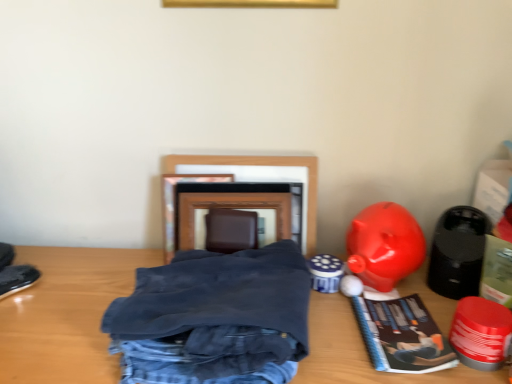
Question: From the image's perspective, is shiny plastic piggy bank at right, arranged as the first toy when viewed from the left, under black matte speaker at right, the 1th toy viewed from the right?

Choices:
 (A) yes
 (B) no

Answer: (B)

Question: From a real-world perspective, does shiny plastic piggy bank at right, which is counted as the third toy, starting from the right, stand above black matte speaker at right, the 1th toy viewed from the right?

Choices:
 (A) yes
 (B) no

Answer: (A)

Question: Does shiny plastic piggy bank at right, which is counted as the third toy, starting from the right, appear on the left side of black matte speaker at right, acting as the third toy starting from the left?

Choices:
 (A) yes
 (B) no

Answer: (A)

Question: Are shiny plastic piggy bank at right, arranged as the first toy when viewed from the left, and black matte speaker at right, acting as the third toy starting from the left, far apart?

Choices:
 (A) yes
 (B) no

Answer: (B)

Question: Considering the relative sizes of shiny plastic piggy bank at right, which is counted as the third toy, starting from the right, and black matte speaker at right, the 1th toy viewed from the right, in the image provided, is shiny plastic piggy bank at right, which is counted as the third toy, starting from the right, thinner than black matte speaker at right, the 1th toy viewed from the right,?

Choices:
 (A) yes
 (B) no

Answer: (B)

Question: Is shiny plastic piggy bank at right, arranged as the first toy when viewed from the left, beside black matte speaker at right, acting as the third toy starting from the left?

Choices:
 (A) yes
 (B) no

Answer: (B)

Question: From the image's perspective, is wooden picture frame at center on shiny plastic piggy bank at right, which is counted as the third toy, starting from the right?

Choices:
 (A) no
 (B) yes

Answer: (B)

Question: Is wooden picture frame at center turned away from shiny plastic piggy bank at right, which is counted as the third toy, starting from the right?

Choices:
 (A) no
 (B) yes

Answer: (A)

Question: Would you say shiny plastic piggy bank at right, arranged as the first toy when viewed from the left, is part of wooden picture frame at center's contents?

Choices:
 (A) no
 (B) yes

Answer: (A)

Question: Can you confirm if wooden picture frame at center is thinner than shiny plastic piggy bank at right, which is counted as the third toy, starting from the right?

Choices:
 (A) no
 (B) yes

Answer: (B)

Question: From a real-world perspective, does wooden picture frame at center stand above shiny plastic piggy bank at right, arranged as the first toy when viewed from the left?

Choices:
 (A) no
 (B) yes

Answer: (B)

Question: Are wooden picture frame at center and shiny plastic piggy bank at right, arranged as the first toy when viewed from the left, far apart?

Choices:
 (A) yes
 (B) no

Answer: (B)

Question: Is shiny red plastic toy at lower right, the second toy viewed from the left, to the right of wooden picture frame at center from the viewer's perspective?

Choices:
 (A) yes
 (B) no

Answer: (A)